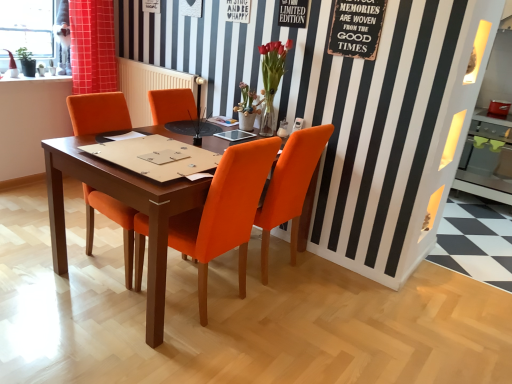
Question: From a real-world perspective, relative to wooden table at center, is rustic wood signboard at upper right vertically above or below?

Choices:
 (A) below
 (B) above

Answer: (B)

Question: Considering the positions of rustic wood signboard at upper right and wooden table at center in the image, is rustic wood signboard at upper right bigger or smaller than wooden table at center?

Choices:
 (A) small
 (B) big

Answer: (A)

Question: Which of these objects is positioned farthest from the orange leather chair at center, acting as the first chair starting from the left?

Choices:
 (A) matte orange vase at center, which appears as the 2th flower when viewed from the right
 (B) limited edition paper at upper center
 (C) wooden table at center
 (D) orange fabric curtain at upper left
 (E) orange fabric chair at center, the 2th chair from the right

Answer: (B)

Question: Which object is positioned closest to the rustic wood signboard at upper right?

Choices:
 (A) orange fabric curtain at upper left
 (B) limited edition paper at upper center
 (C) matte orange vase at center, which appears as the 2th flower when viewed from the right
 (D) matte glass vase at upper center, the second flower from the left
 (E) wooden table at center

Answer: (B)